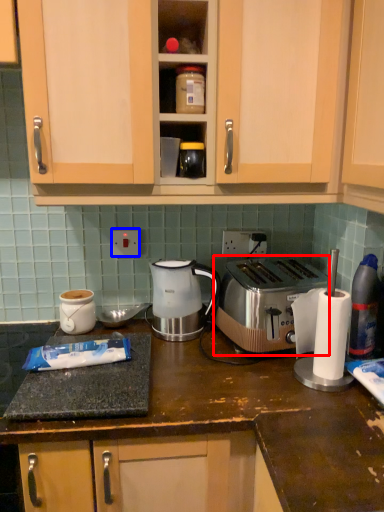
Question: Which object appears closest to the camera in this image, toaster (highlighted by a red box) or electric outlet (highlighted by a blue box)?

Choices:
 (A) toaster
 (B) electric outlet

Answer: (A)